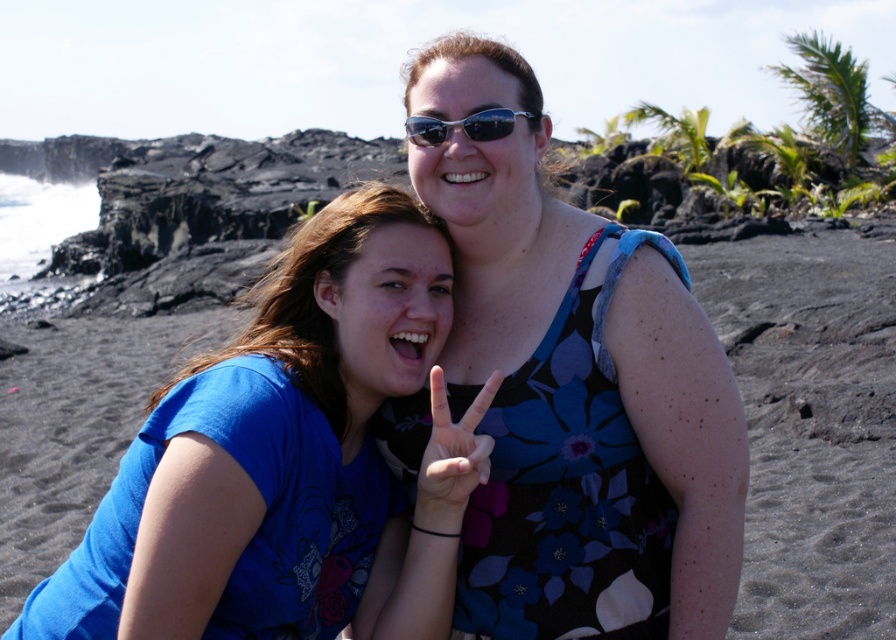
Question: Considering the relative positions of blue cotton shirt at center and black plastic sunglasses at center in the image provided, where is blue cotton shirt at center located with respect to black plastic sunglasses at center?

Choices:
 (A) left
 (B) right

Answer: (A)

Question: Which of these objects is positioned farthest from the blue cotton shirt at center?

Choices:
 (A) black plastic sunglasses at center
 (B) matte floral dress at center

Answer: (A)

Question: Does matte floral dress at center appear on the left side of black plastic sunglasses at center?

Choices:
 (A) yes
 (B) no

Answer: (A)

Question: Among these points, which one is farthest from the camera?

Choices:
 (A) (285, 296)
 (B) (517, 112)
 (C) (418, 492)
 (D) (573, 481)

Answer: (A)

Question: Can you confirm if floral dress at center is positioned above black plastic sunglasses at center?

Choices:
 (A) no
 (B) yes

Answer: (A)

Question: Which object is the closest to the blue cotton shirt at center?

Choices:
 (A) black plastic sunglasses at center
 (B) floral dress at center

Answer: (B)